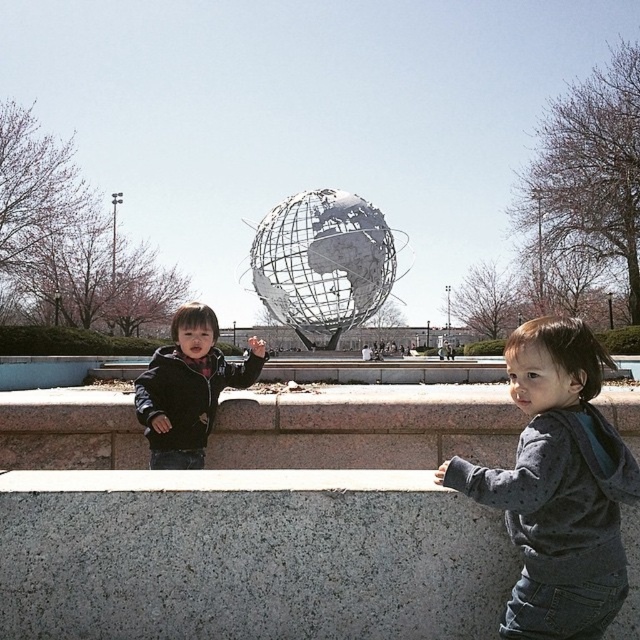
Question: Based on their relative distances, which object is nearer to the gray speckled hoodie at lower right?

Choices:
 (A) matte black jacket at center
 (B) metallic globe at center

Answer: (A)

Question: Which object appears farthest from the camera in this image?

Choices:
 (A) matte black jacket at center
 (B) gray speckled hoodie at lower right

Answer: (A)

Question: Which point is closer to the camera taking this photo?

Choices:
 (A) (620, 467)
 (B) (188, 385)

Answer: (A)

Question: Is gray speckled hoodie at lower right closer to camera compared to matte black jacket at center?

Choices:
 (A) yes
 (B) no

Answer: (A)

Question: Considering the relative positions of gray speckled hoodie at lower right and matte black jacket at center in the image provided, where is gray speckled hoodie at lower right located with respect to matte black jacket at center?

Choices:
 (A) left
 (B) right

Answer: (B)

Question: Observing the image, what is the correct spatial positioning of gray speckled hoodie at lower right in reference to matte black jacket at center?

Choices:
 (A) above
 (B) below

Answer: (B)